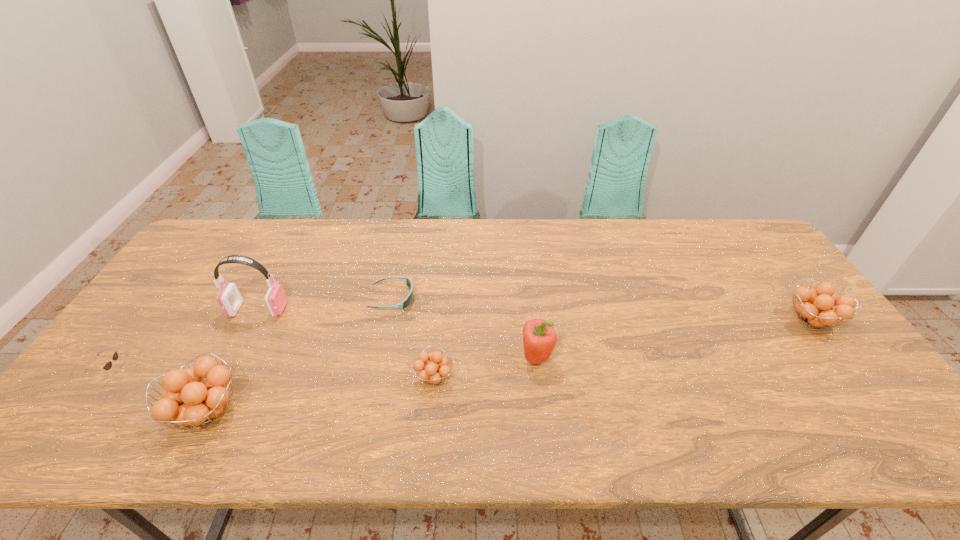
Image resolution: width=960 pixels, height=540 pixels. Find the location of `free space between the earphone and the leftmost orange fruit`. free space between the earphone and the leftmost orange fruit is located at coordinates (232, 361).

Locate an element on the screen. The height and width of the screenshot is (540, 960). vacant space in between the leftmost orange fruit and the fifth object from left to right is located at coordinates (321, 394).

Find the location of a particular element. The width and height of the screenshot is (960, 540). vacant point located between the leftmost object and the pepper is located at coordinates (324, 365).

You are a GUI agent. You are given a task and a screenshot of the screen. Output one action in this format:
    pyautogui.click(x=<x>, y=<y>)
    Task: Click on the free point between the second orange fruit from right to left and the nearer sunglasses
    
    Given the screenshot: What is the action you would take?
    pyautogui.click(x=273, y=375)

Locate an element on the screen. vacant space that is in between the nearer sunglasses and the leftmost orange fruit is located at coordinates (159, 392).

Identify the location of vacant space in between the sixth object from left to right and the second orange fruit from right to left. (486, 368).

The image size is (960, 540). I want to click on free spot between the earphone and the leftmost orange fruit, so click(x=232, y=361).

Select which object appears as the sixth closest to the earphone. Please provide its 2D coordinates. Your answer should be formatted as a tuple, i.e. [(x, y)], where the tuple contains the x and y coordinates of a point satisfying the conditions above.

[(815, 307)]

This screenshot has width=960, height=540. What are the coordinates of `object identified as the fifth closest to the shorter sunglasses` in the screenshot? It's located at (108, 365).

I want to click on orange fruit that stands as the closest to the shortest orange fruit, so click(x=204, y=402).